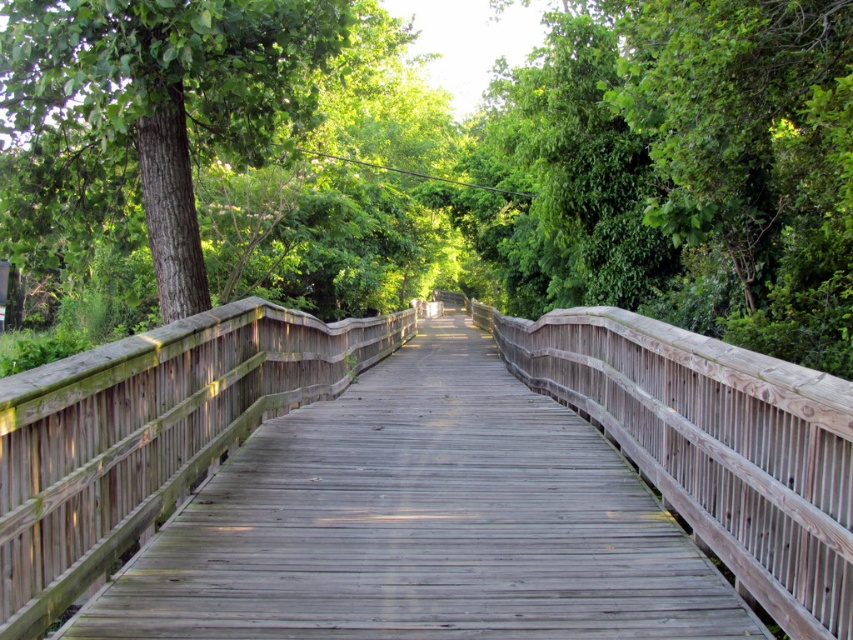
You are standing on the weathered wood bridge at center and want to take a photo of the green rough bark tree at left. Since the bridge curves to the right, will the tree be visible in your photo if you face forward?

The weathered wood bridge at center is closer to the viewer than the green rough bark tree at left. Since the bridge curves to the right, the tree at left may not be directly in front when facing forward. However, because the tree is behind the bridge, it might still be partially visible depending on the camera angle and how much the bridge obscures the view. The description does not specify the exact position, so visibility could vary.

You are standing on the weathered wood bridge at center and looking towards the green leafy tree at center. Which object appears wider from your perspective?

The green leafy tree at center appears wider than the weathered wood bridge at center because its width surpasses the bridge.